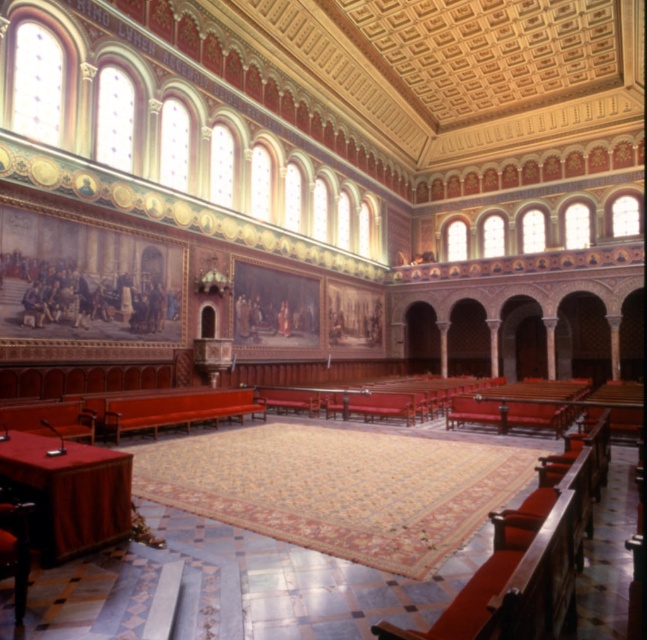
Question: Is matte red bench at center closer to camera compared to wooden polished bench at lower left?

Choices:
 (A) no
 (B) yes

Answer: (A)

Question: Is metallic polished chair at lower left closer to camera compared to wooden polished bench at lower left?

Choices:
 (A) yes
 (B) no

Answer: (A)

Question: Does matte red bench at center appear on the right side of metallic polished chair at lower left?

Choices:
 (A) no
 (B) yes

Answer: (A)

Question: Among these points, which one is farthest from the camera?

Choices:
 (A) (91, 432)
 (B) (173, 426)

Answer: (B)

Question: Which is nearer to the matte red bench at center?

Choices:
 (A) metallic polished chair at lower left
 (B) wooden polished bench at lower left

Answer: (B)

Question: Which point is closer to the camera taking this photo?

Choices:
 (A) (263, 419)
 (B) (5, 486)
 (C) (93, 428)

Answer: (B)